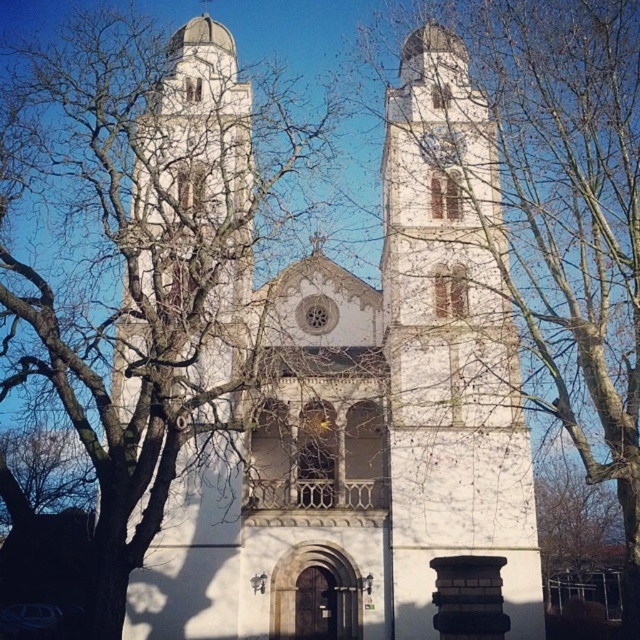
You are standing in a park and see the white stone church at center. If you want to take a photo of the church without any trees blocking it, where should you move relative to your current position?

Since the white stone church at center is at point (371, 416), you should move to the left side to avoid the trees blocking the view.

You are standing in a park and see the white stone church at center. If you were to draw a straight line from your current position to the church, what coordinate would you aim for?

The white stone church at center is located at the 2D coordinate point of (371,416), so you should aim for that point.

You are standing in front of the historic church with two towers and domes. There is a point at coordinates point [419,86]. Can you estimate how far this point is from your current position?

The point at point [419,86] is 84.30 meters away from the camera, so the distance from your current position to that point is approximately 84.30 meters.